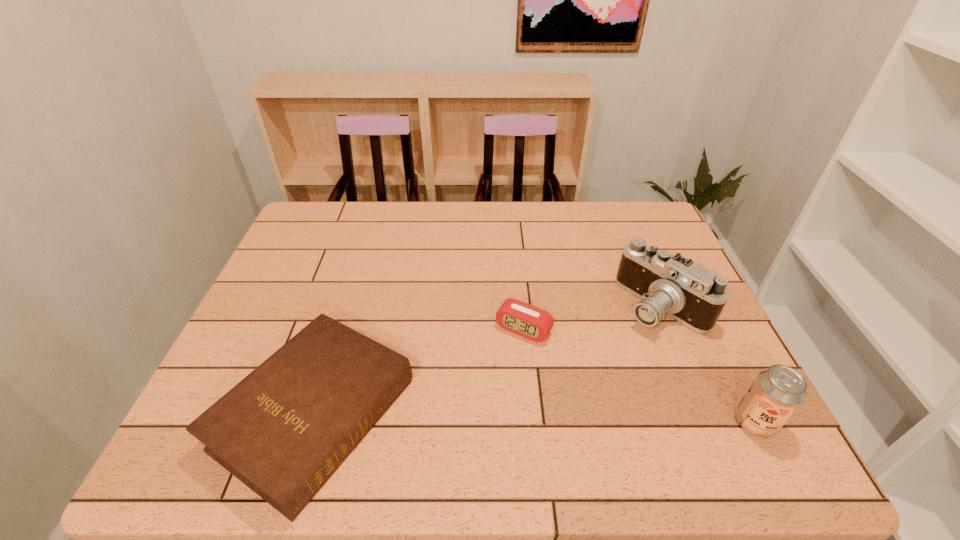
The image size is (960, 540). What are the coordinates of `vacant space located 0.120m on the front-facing side of the second object from left to right` in the screenshot? It's located at (488, 380).

The image size is (960, 540). I want to click on vacant space located 0.300m at the lens of the camera, so click(x=544, y=379).

Find the location of a particular element. free location located 0.200m at the lens of the camera is located at coordinates (577, 359).

Identify the location of vacant region located 0.120m at the lens of the camera. (601, 344).

Where is `Bible that is positioned at the near edge`? The width and height of the screenshot is (960, 540). Bible that is positioned at the near edge is located at coordinates (283, 430).

At what (x,y) coordinates should I click in order to perform the action: click on beer can present at the near edge. Please return your answer as a coordinate pair (x, y). This screenshot has width=960, height=540. Looking at the image, I should click on (777, 392).

Identify the location of object at the left edge. The height and width of the screenshot is (540, 960). (283, 430).

Identify the location of beer can positioned at the right edge. This screenshot has width=960, height=540. (777, 392).

The height and width of the screenshot is (540, 960). I want to click on camera that is at the right edge, so click(x=688, y=292).

In order to click on object located at the near left corner in this screenshot , I will do `click(283, 430)`.